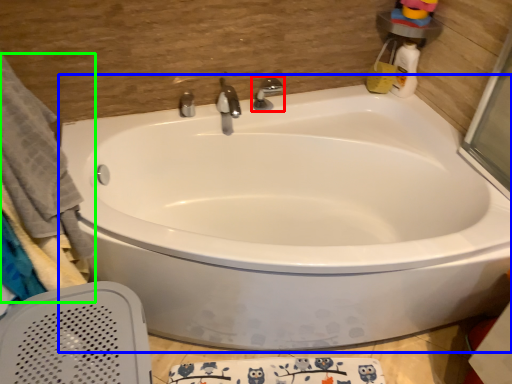
Question: Considering the real-world distances, which object is farthest from tap (highlighted by a red box)? bathtub (highlighted by a blue box) or bath towel (highlighted by a green box)?

Choices:
 (A) bathtub
 (B) bath towel

Answer: (B)